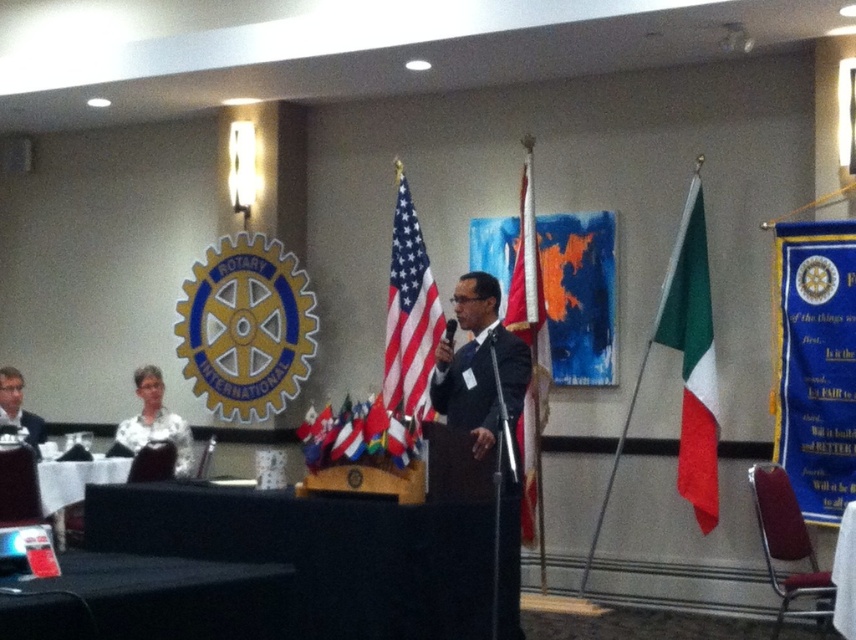
Is blue fabric banner at right positioned before white fabric shirt at lower left?

Yes, it is in front of white fabric shirt at lower left.

Does point (825, 289) lie behind point (153, 410)?

No, (825, 289) is closer to viewer.

Locate an element on the screen. This screenshot has width=856, height=640. blue fabric banner at right is located at coordinates (815, 364).

Does white fabric flag at center appear on the left side of white fabric shirt at lower left?

In fact, white fabric flag at center is to the right of white fabric shirt at lower left.

Is point (528, 436) more distant than point (176, 451)?

No, it is in front of (176, 451).

Locate an element on the screen. The image size is (856, 640). white fabric flag at center is located at coordinates (528, 349).

Which is in front, point (409, 308) or point (171, 417)?

Positioned in front is point (409, 308).

Is american flag at center to the right of white fabric shirt at lower left from the viewer's perspective?

Correct, you'll find american flag at center to the right of white fabric shirt at lower left.

In order to click on american flag at center in this screenshot , I will do pos(409,316).